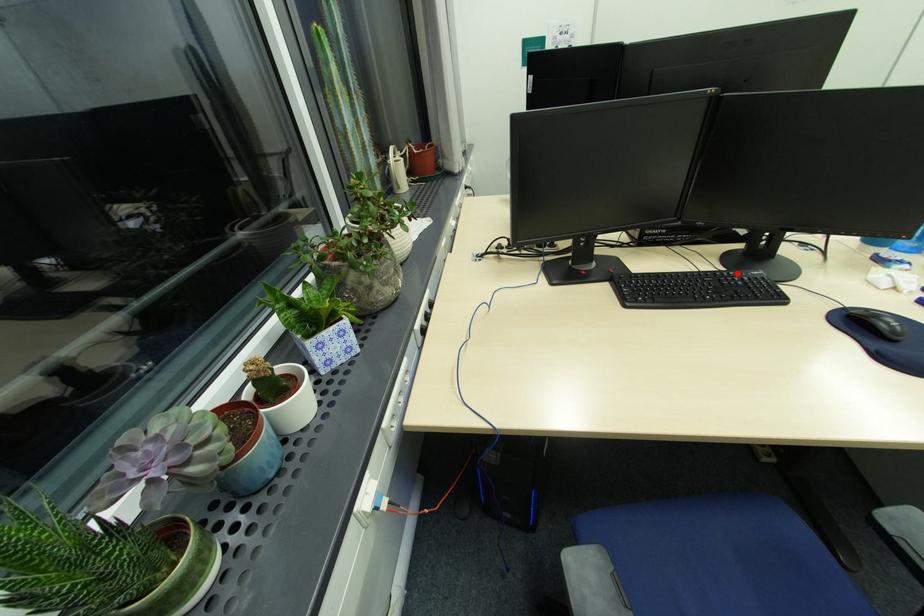
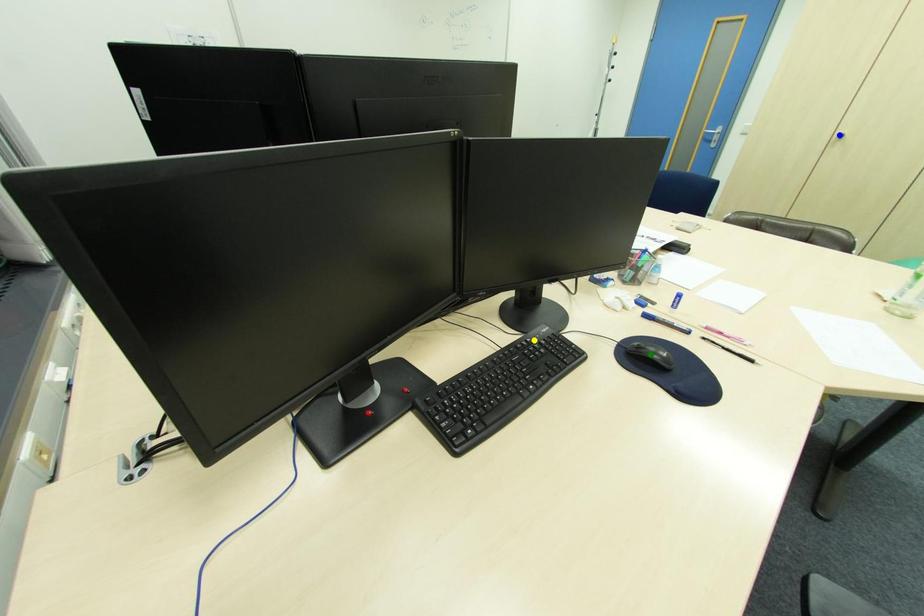
Question: I am providing you with two images of the same scene from different viewpoints. A red point is marked on the first image. You are given multiple points on the second image. Which point in image 2 is actually the same real-world point as the red point in image 1?

Choices:
 (A) blue point
 (B) green point
 (C) yellow point

Answer: (C)